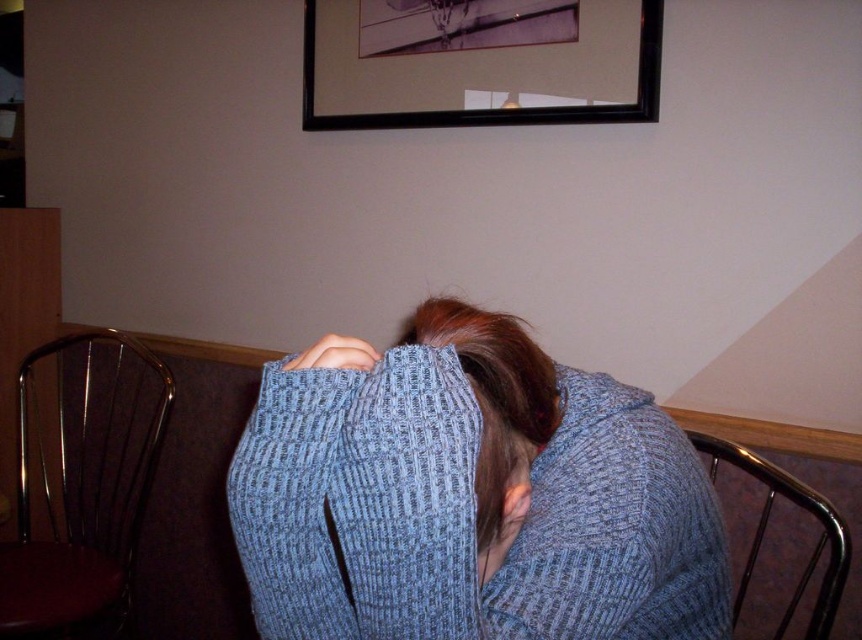
Can you confirm if metallic brown chair at left is taller than blue knitted hair at center?

Indeed, metallic brown chair at left has a greater height compared to blue knitted hair at center.

Does metallic brown chair at left have a lesser height compared to blue knitted hair at center?

No, metallic brown chair at left is not shorter than blue knitted hair at center.

I want to click on metallic brown chair at left, so click(83, 483).

This screenshot has width=862, height=640. Find the location of `metallic brown chair at left`. metallic brown chair at left is located at coordinates (83, 483).

Is blue knitted hair at center wider than metallic silver chair at lower right?

In fact, blue knitted hair at center might be narrower than metallic silver chair at lower right.

This screenshot has width=862, height=640. In order to click on blue knitted hair at center in this screenshot , I will do `click(494, 396)`.

Between point (442, 310) and point (847, 573), which one is positioned behind?

Positioned behind is point (847, 573).

The image size is (862, 640). Find the location of `blue knitted hair at center`. blue knitted hair at center is located at coordinates (494, 396).

Can you confirm if black matte picture frame at upper center is shorter than blue knitted hair at center?

No.

Does point (504, 42) come farther from viewer compared to point (497, 380)?

That is True.

I want to click on black matte picture frame at upper center, so click(x=479, y=61).